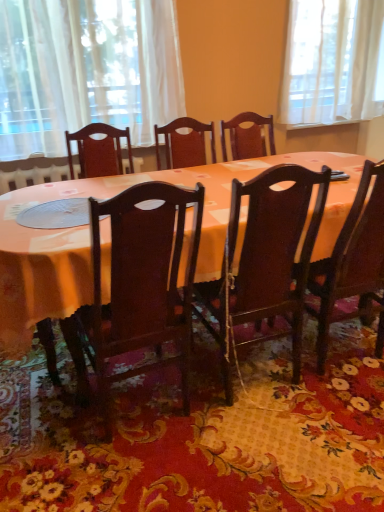
Question: Which is correct: white sheer curtain at upper left is inside dark wood chair at center, acting as the second chair starting from the right, or outside of it?

Choices:
 (A) outside
 (B) inside

Answer: (A)

Question: Considering the positions of point (36, 32) and point (296, 377), is point (36, 32) closer or farther from the camera than point (296, 377)?

Choices:
 (A) closer
 (B) farther

Answer: (B)

Question: Which object is the farthest from the white sheer curtain at upper left?

Choices:
 (A) orange fabric mat at center
 (B) matte wood table at center
 (C) dark wood chair at center, the 3th chair when ordered from right to left
 (D) dark wood chair at right, which appears as the 3th chair when viewed from the left
 (E) dark wood chair at center, marked as the second chair in a left-to-right arrangement

Answer: (D)

Question: Which is farther from the orange fabric mat at center?

Choices:
 (A) dark wood chair at center, marked as the second chair in a left-to-right arrangement
 (B) white sheer curtain at upper left
 (C) dark wood chair at center, the 3th chair when ordered from right to left
 (D) dark wood chair at right, which is counted as the first chair, starting from the right
 (E) matte wood table at center

Answer: (B)